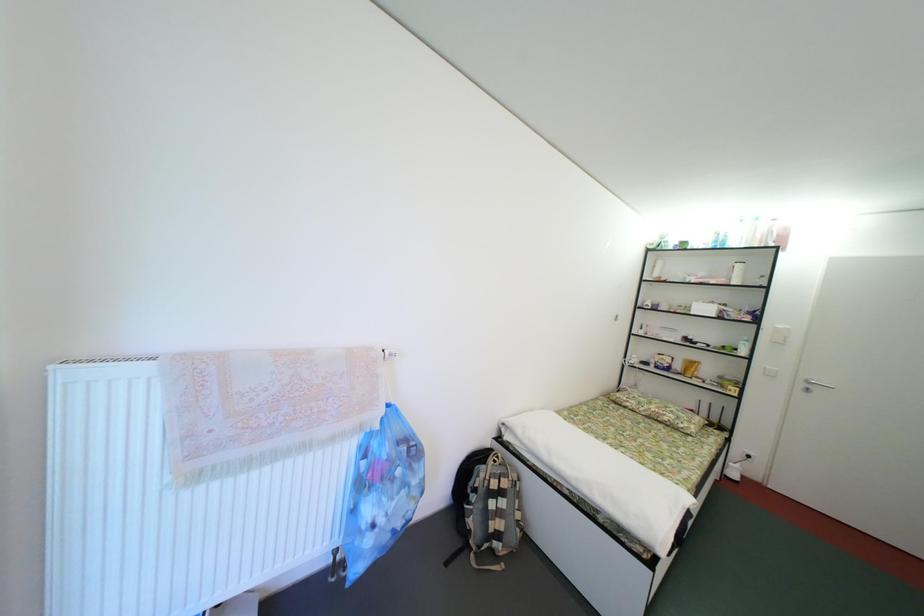
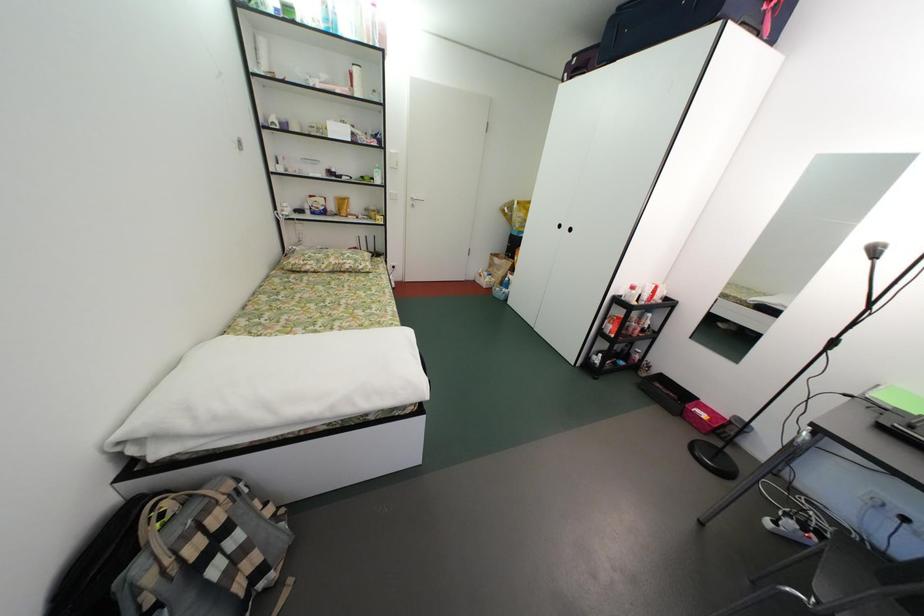
How did the camera likely rotate?

The camera rotated toward right-down.